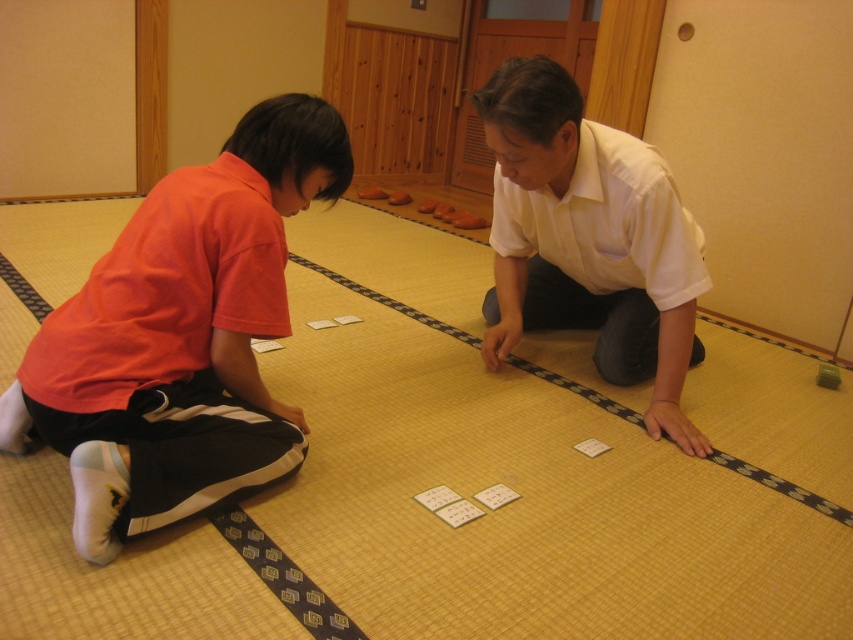
Can you confirm if orange fabric shirt at left is thinner than white matte shirt at center?

Correct, orange fabric shirt at left's width is less than white matte shirt at center's.

Who is shorter, orange fabric shirt at left or white matte shirt at center?

Standing shorter between the two is orange fabric shirt at left.

Which is in front, point (194, 337) or point (584, 323)?

Point (194, 337) is in front.

Locate an element on the screen. The height and width of the screenshot is (640, 853). orange fabric shirt at left is located at coordinates (181, 336).